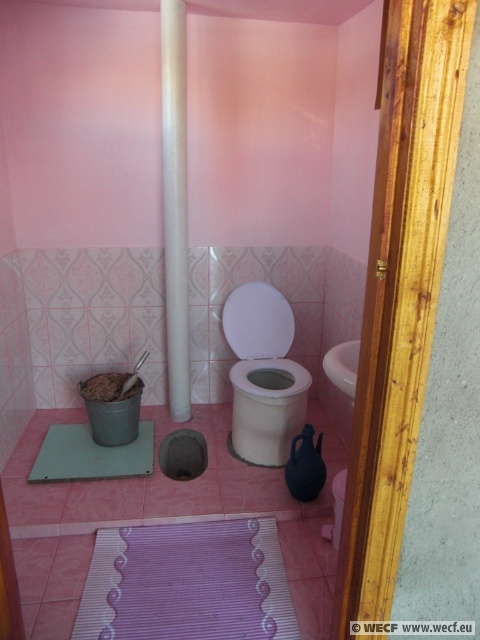
You are a cleaning robot in the bathroom. You need to clean the white glossy toilet bowl at center and the green rubber bath mat at lower center. Which object should you clean first if you want to avoid stepping on the mat while cleaning the toilet?

You should clean the green rubber bath mat at lower center first because the white glossy toilet bowl at center is positioned over it, so stepping on the mat would be necessary to reach the toilet, but cleaning the mat first would prevent it from getting dirty again during the process.